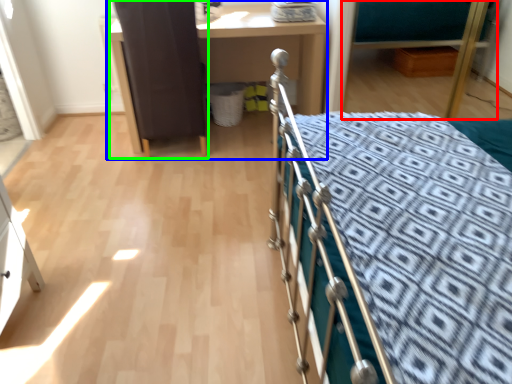
Question: Considering the real-world distances, which object is closest to hospital bed (highlighted by a red box)? desk (highlighted by a blue box) or screen door (highlighted by a green box).

Choices:
 (A) desk
 (B) screen door

Answer: (A)